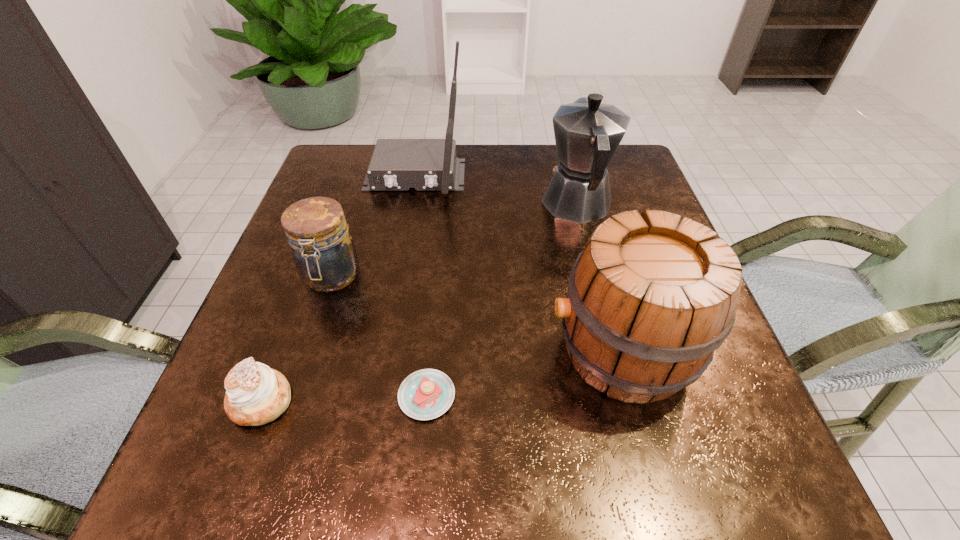
Identify the location of router. This screenshot has height=540, width=960. (397, 164).

Where is `coffeepot`? Image resolution: width=960 pixels, height=540 pixels. coffeepot is located at coordinates (587, 132).

Find the location of a particular element. cider is located at coordinates (649, 302).

Where is `jar`? jar is located at coordinates (324, 253).

Identify the location of the taller pastry. Image resolution: width=960 pixels, height=540 pixels. (256, 394).

At what (x,y) coordinates should I click in order to perform the action: click on the left pastry. Please return your answer as a coordinate pair (x, y). Looking at the image, I should click on (256, 394).

I want to click on the shortest object, so click(x=426, y=394).

Find the location of a particular element. Image resolution: width=960 pixels, height=540 pixels. the right pastry is located at coordinates (426, 394).

Identify the location of vacant region located 0.400m on the back of the router to connect cables. (386, 339).

Image resolution: width=960 pixels, height=540 pixels. I want to click on free location located 0.090m at the spout of the coffeepot, so click(x=565, y=159).